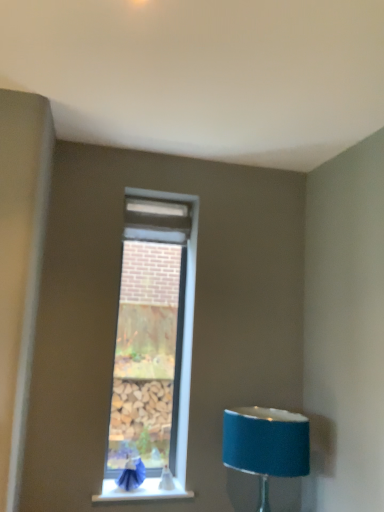
Question: Is blue fabric swivel chair at lower left wider than white smooth window sill at lower center?

Choices:
 (A) no
 (B) yes

Answer: (A)

Question: From a real-world perspective, is blue fabric swivel chair at lower left on top of white smooth window sill at lower center?

Choices:
 (A) yes
 (B) no

Answer: (A)

Question: Considering the relative positions of blue fabric swivel chair at lower left and white smooth window sill at lower center in the image provided, is blue fabric swivel chair at lower left to the right of white smooth window sill at lower center from the viewer's perspective?

Choices:
 (A) yes
 (B) no

Answer: (B)

Question: Is blue fabric swivel chair at lower left in front of white smooth window sill at lower center?

Choices:
 (A) no
 (B) yes

Answer: (A)

Question: Does blue fabric swivel chair at lower left have a lesser width compared to white smooth window sill at lower center?

Choices:
 (A) yes
 (B) no

Answer: (A)

Question: Is blue fabric swivel chair at lower left with white smooth window sill at lower center?

Choices:
 (A) no
 (B) yes

Answer: (B)

Question: Is blue fabric lampshade at lower right not within white smooth window sill at lower center?

Choices:
 (A) yes
 (B) no

Answer: (A)

Question: Considering the relative sizes of blue fabric lampshade at lower right and white smooth window sill at lower center in the image provided, is blue fabric lampshade at lower right wider than white smooth window sill at lower center?

Choices:
 (A) no
 (B) yes

Answer: (B)

Question: Can white smooth window sill at lower center be found inside blue fabric lampshade at lower right?

Choices:
 (A) no
 (B) yes

Answer: (A)

Question: Considering the relative positions of blue fabric lampshade at lower right and white smooth window sill at lower center in the image provided, is blue fabric lampshade at lower right to the right of white smooth window sill at lower center from the viewer's perspective?

Choices:
 (A) yes
 (B) no

Answer: (A)

Question: Considering the relative sizes of blue fabric lampshade at lower right and white smooth window sill at lower center in the image provided, is blue fabric lampshade at lower right thinner than white smooth window sill at lower center?

Choices:
 (A) no
 (B) yes

Answer: (A)

Question: Is blue fabric lampshade at lower right not close to white smooth window sill at lower center?

Choices:
 (A) yes
 (B) no

Answer: (B)

Question: Is white smooth window sill at lower center located outside blue fabric lampshade at lower right?

Choices:
 (A) no
 (B) yes

Answer: (B)